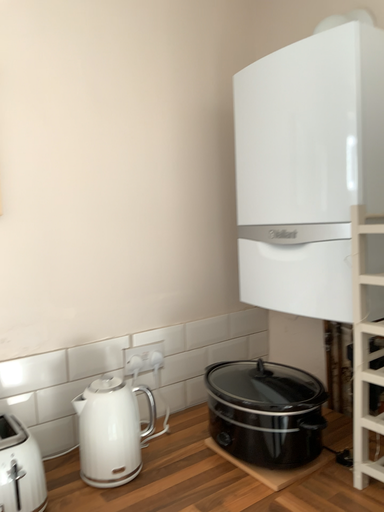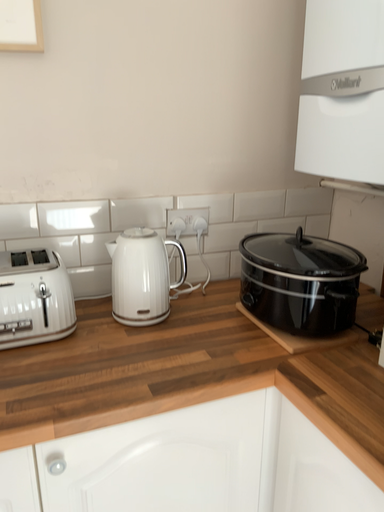
Question: Which way did the camera rotate in the video?

Choices:
 (A) rotated upward
 (B) rotated downward

Answer: (B)